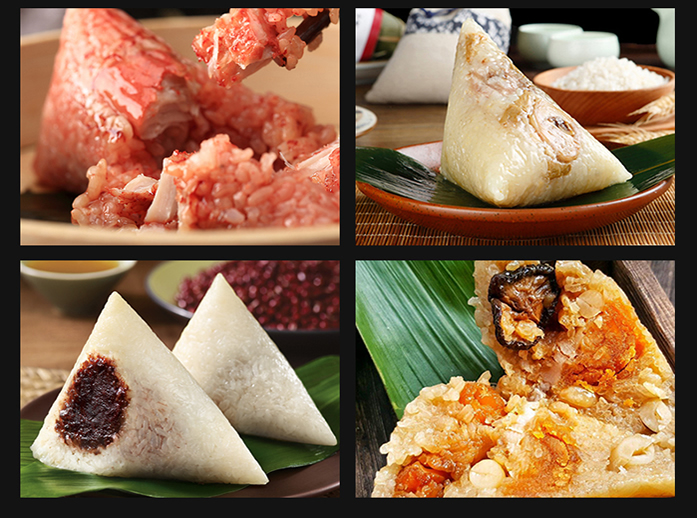
Locate an element on the screen. The image size is (697, 518). plate is located at coordinates (603, 97).